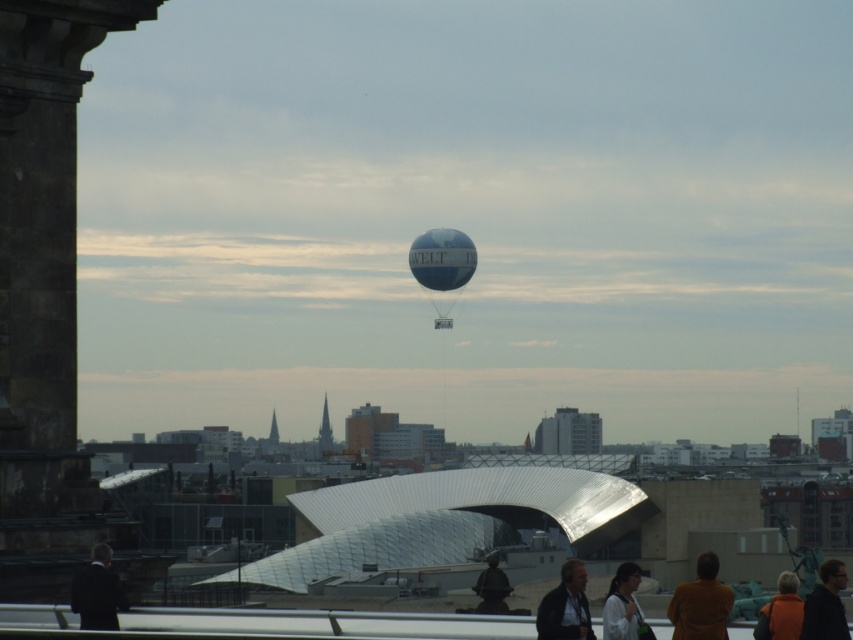
Question: Does brown wool coat at lower right appear on the right side of dark blue jacket at lower center?

Choices:
 (A) no
 (B) yes

Answer: (B)

Question: Does orange life vest at lower right have a smaller size compared to matte brown statue at center?

Choices:
 (A) yes
 (B) no

Answer: (B)

Question: Which point is closer to the camera?

Choices:
 (A) [x=801, y=602]
 (B) [x=558, y=632]
 (C) [x=428, y=243]
 (D) [x=618, y=580]

Answer: (B)

Question: Which of the following is the closest to the observer?

Choices:
 (A) (74, 579)
 (B) (590, 624)
 (C) (616, 636)

Answer: (B)

Question: Is brown wool coat at lower right to the right of dark suit at lower left from the viewer's perspective?

Choices:
 (A) no
 (B) yes

Answer: (B)

Question: Which object appears farthest from the camera in this image?

Choices:
 (A) dark suit at lower left
 (B) brown wool coat at lower right
 (C) white shirt at lower center

Answer: (C)